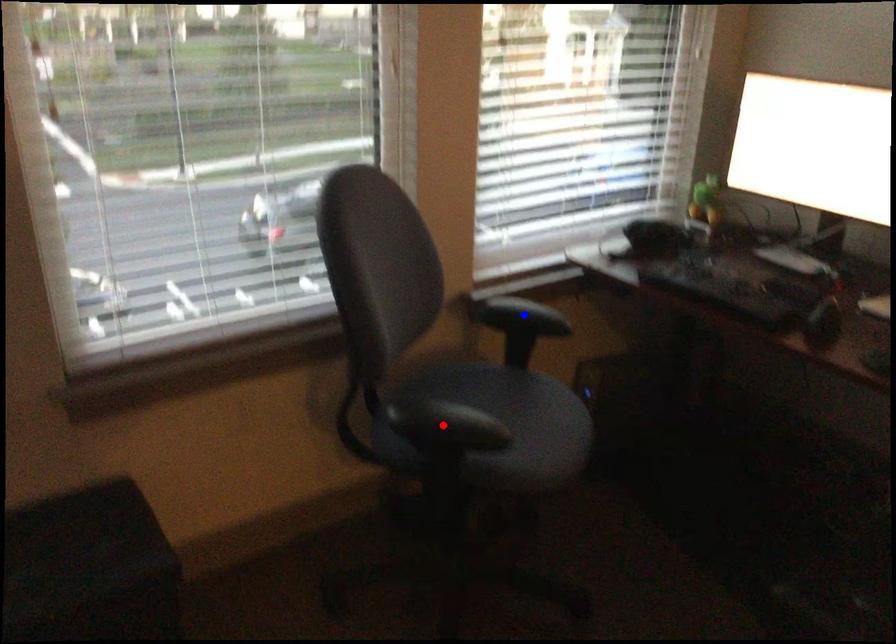
Question: In the image, two points are highlighted. Which point is nearer to the camera? Reply with the corresponding letter.

Choices:
 (A) blue point
 (B) red point

Answer: (B)